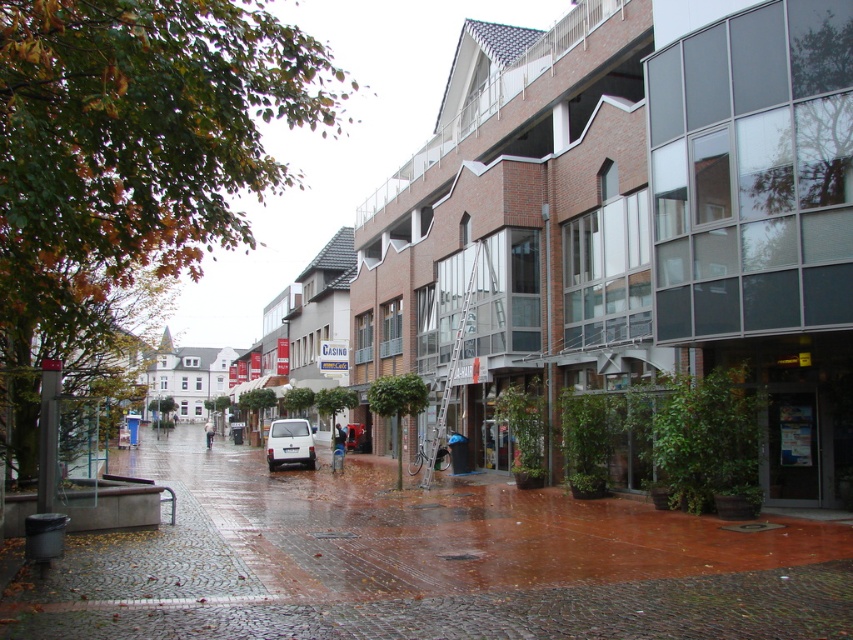
You are a delivery person trying to park your white matte van at center in a spot that requires the vehicle to be entirely within the brick pavement at center. Given the dimensions of both, will the van fit within the pavement area?

The brick pavement at center is wider than the white matte van at center, so the van will fit within the pavement area as its width is smaller than the pavement.

Based on the photo, you are a delivery person trying to navigate through the wet urban street scene. You need to determine if the white matte van at center can pass under the brick pavement at center without hitting it. Can it?

The brick pavement at center is taller than the white matte van at center, so the van can safely pass under the brick pavement at center without hitting it.